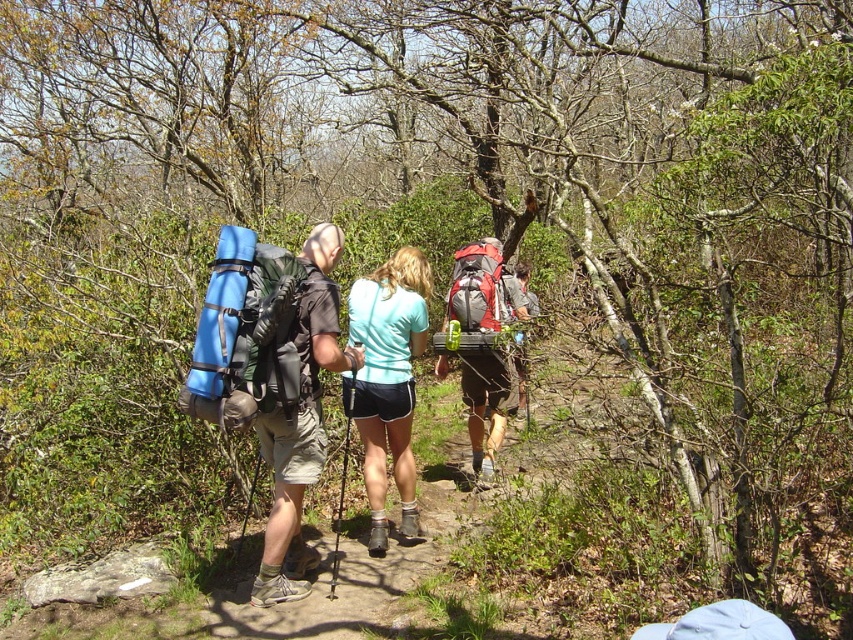
Question: Where is teal fabric shorts at center located in relation to red fabric backpack at center in the image?

Choices:
 (A) above
 (B) below

Answer: (B)

Question: Among these points, which one is farthest from the camera?

Choices:
 (A) (387, 544)
 (B) (479, 324)
 (C) (200, 381)
 (D) (450, 304)

Answer: (D)

Question: Which object is closer to the camera taking this photo?

Choices:
 (A) teal fabric shorts at center
 (B) matte gray backpack at center
 (C) matte black backpack at left

Answer: (C)

Question: Is matte gray backpack at center to the right of red fabric backpack at center from the viewer's perspective?

Choices:
 (A) yes
 (B) no

Answer: (A)

Question: Where is matte gray backpack at center located in relation to red fabric backpack at center in the image?

Choices:
 (A) right
 (B) left

Answer: (A)

Question: Which point is farther to the camera?

Choices:
 (A) red fabric backpack at center
 (B) matte black backpack at left

Answer: (A)